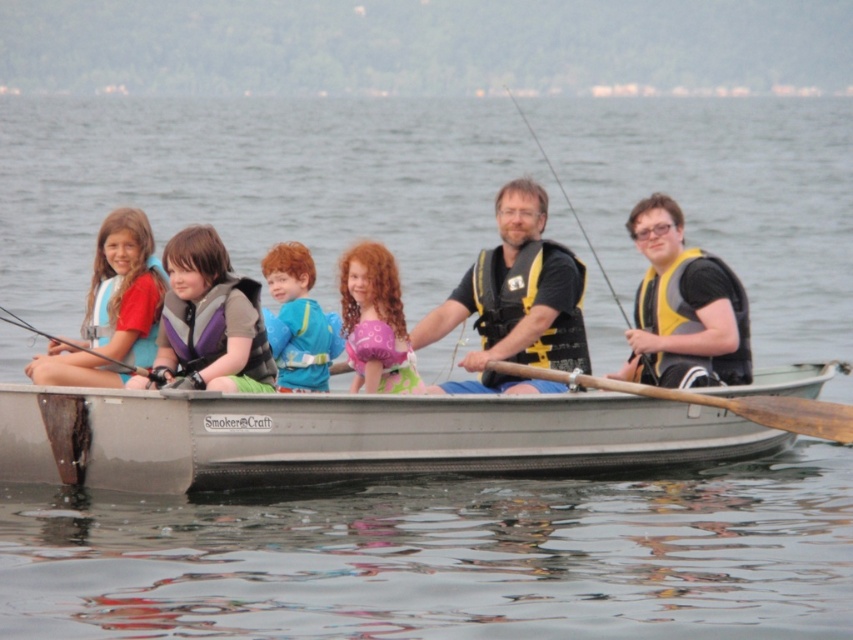
Between purple life vest at center and blue fabric shirt at center, which one is positioned higher?

blue fabric shirt at center is above.

Is the position of purple life vest at center less distant than that of blue fabric shirt at center?

That is True.

Between point (224, 252) and point (277, 282), which one is positioned behind?

The point (277, 282) is behind.

Identify the location of purple life vest at center. The height and width of the screenshot is (640, 853). (210, 317).

Is point (0, 449) less distant than point (569, 358)?

Yes, it is.

Can you confirm if metallic gray boat at center is taller than black/yellow life jacket at center?

Correct, metallic gray boat at center is much taller as black/yellow life jacket at center.

Is point (15, 408) positioned before point (527, 285)?

Yes, point (15, 408) is in front of point (527, 285).

Where is `metallic gray boat at center`? The height and width of the screenshot is (640, 853). metallic gray boat at center is located at coordinates (347, 436).

Who is taller, yellow/black life vest at center or blue fabric shirt at center?

Standing taller between the two is yellow/black life vest at center.

Image resolution: width=853 pixels, height=640 pixels. Identify the location of yellow/black life vest at center. (683, 301).